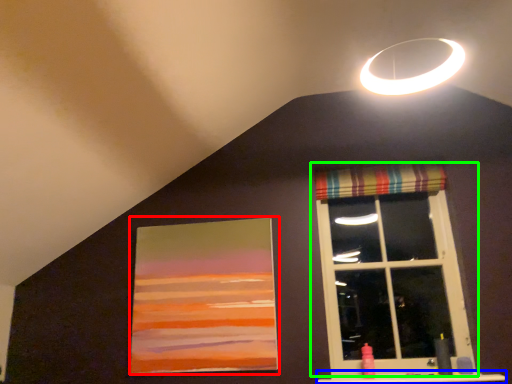
Question: Based on their relative distances, which object is farther from picture frame (highlighted by a red box)? Choose from window sill (highlighted by a blue box) and window (highlighted by a green box).

Choices:
 (A) window sill
 (B) window

Answer: (A)